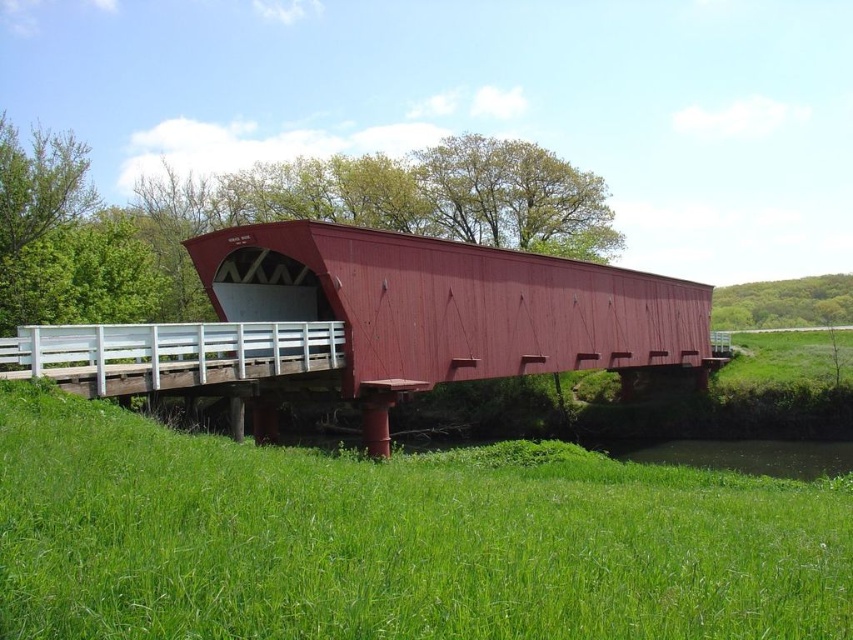
I want to click on green grassy at lower center, so click(x=393, y=540).

Is green grassy at lower center shorter than matte red bridge at center?

Correct, green grassy at lower center is not as tall as matte red bridge at center.

Who is more forward, (381, 477) or (345, 355)?

Positioned in front is point (381, 477).

Where is `green grassy at lower center`? Image resolution: width=853 pixels, height=640 pixels. green grassy at lower center is located at coordinates (393, 540).